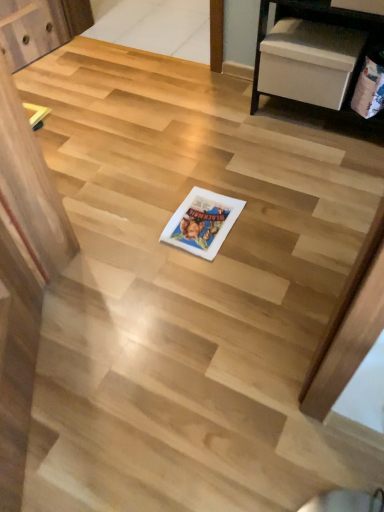
Identify the location of vacant area that is in front of white paper comic book at center, which is counted as the 1th comic book, starting from the left. This screenshot has height=512, width=384. (204, 288).